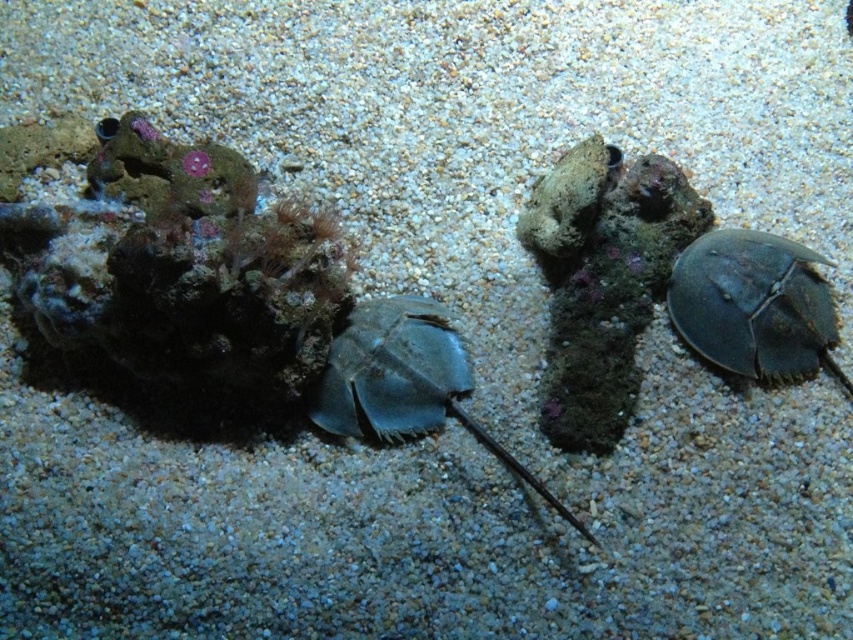
You are a diver observing two points in the underwater scene described. The points are labeled as point 1 at coordinates (769, 336) and point 2 at (318, 378). Which point is closer to your diving mask?

Point 1 at coordinates (769, 336) is closer to your diving mask because it is further to the camera than point 2 at (318, 378).